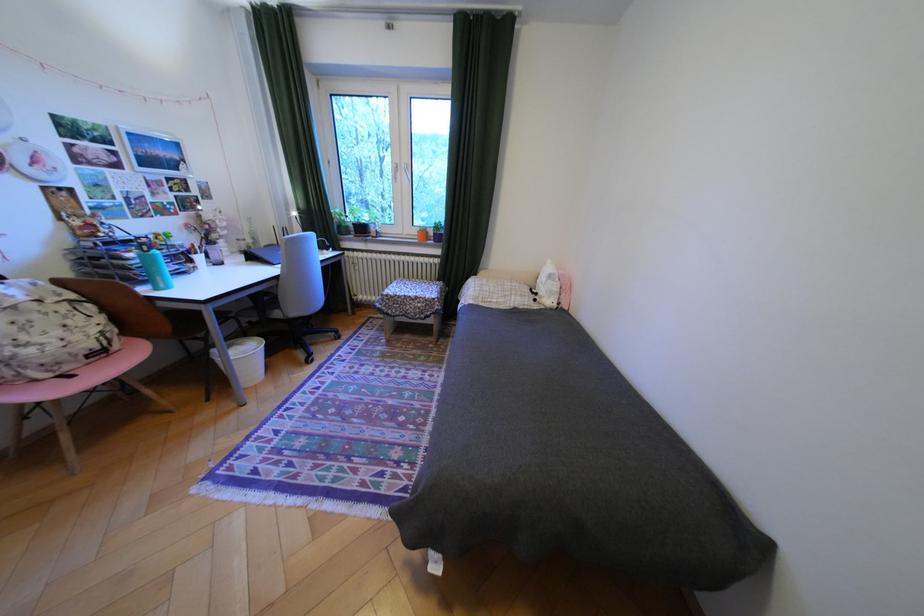
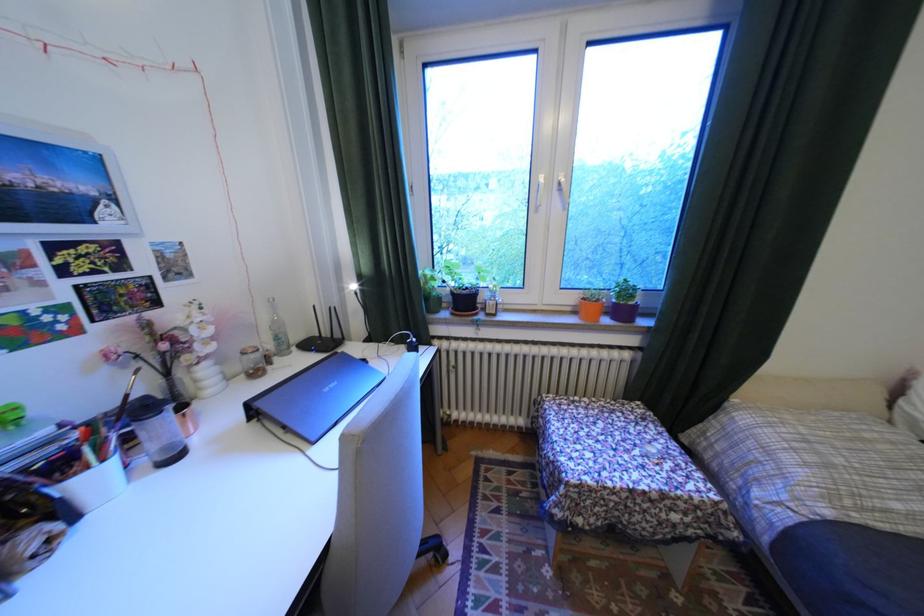
In the second image, find the point that corresponds to point 212,257 in the first image.

(106, 479)